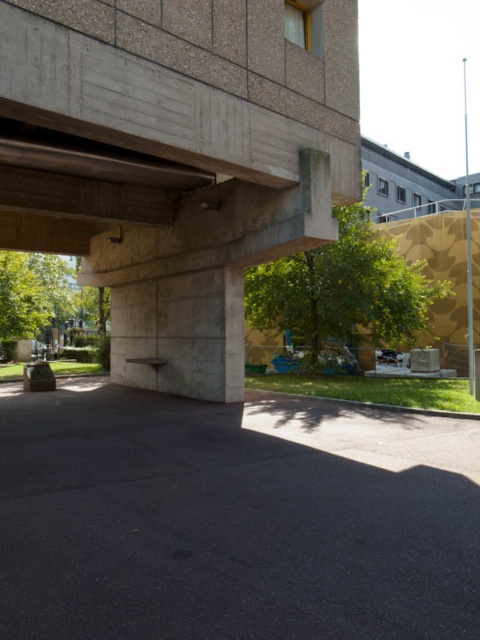
Does gray concrete at center have a lesser width compared to concrete at upper left?

Yes.

Is gray concrete at center closer to the viewer compared to concrete at upper left?

Yes, gray concrete at center is closer to the viewer.

Who is more forward, (323, 488) or (211, 212)?

Point (323, 488) is more forward.

I want to click on gray concrete at center, so [x=232, y=518].